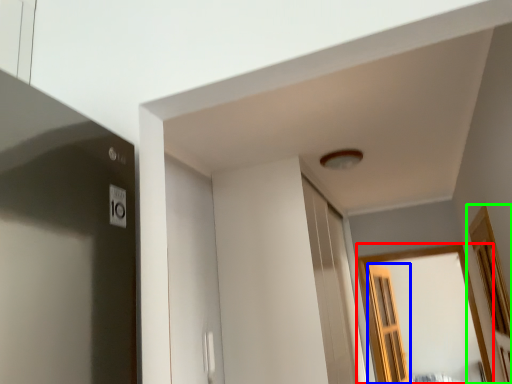
Question: Based on their relative distances, which object is farther from window (highlighted by a red box)? Choose from screen door (highlighted by a blue box) and window (highlighted by a green box).

Choices:
 (A) screen door
 (B) window

Answer: (B)